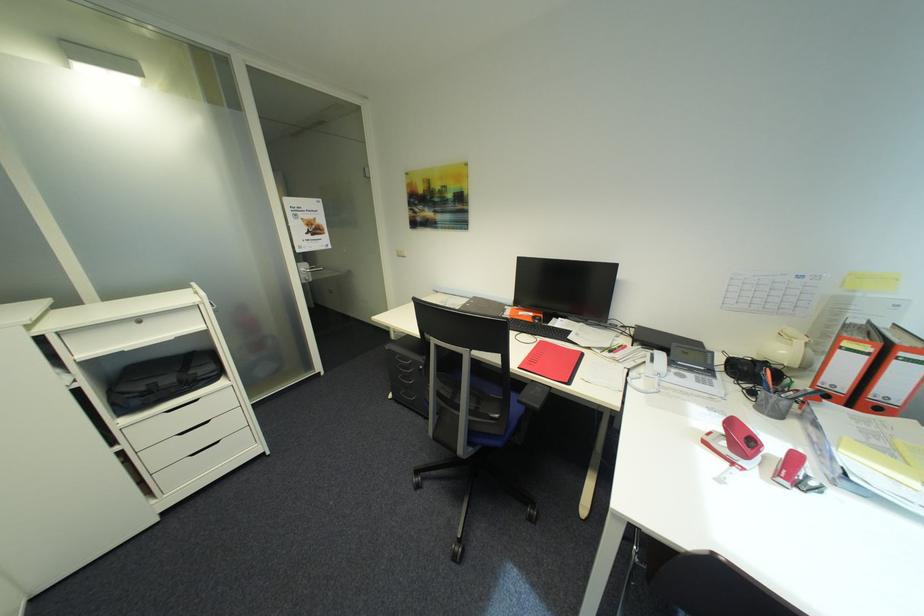
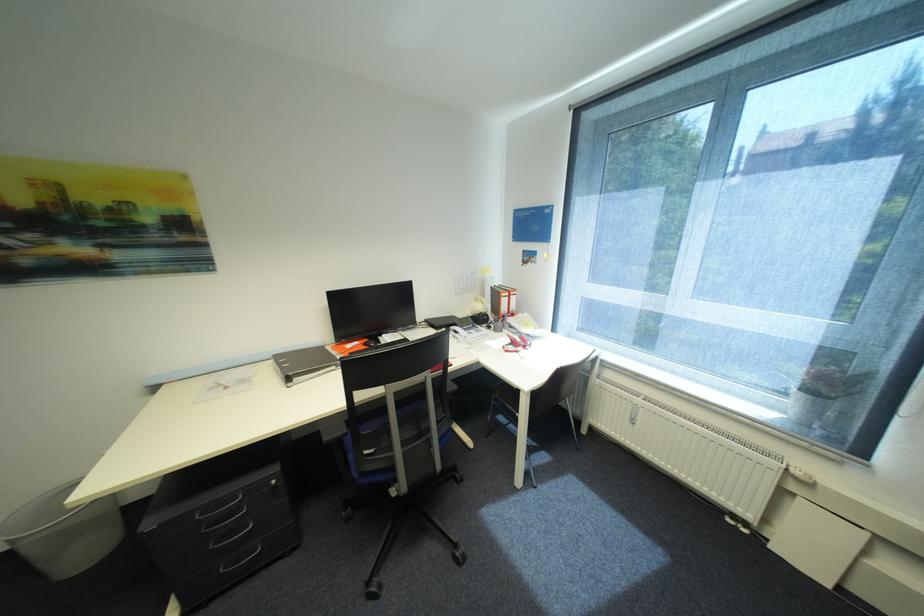
Question: Based on the continuous images, in which direction is the camera rotating? Reply with the corresponding letter.

Choices:
 (A) Left
 (B) Right
 (C) Up
 (D) Down

Answer: (B)